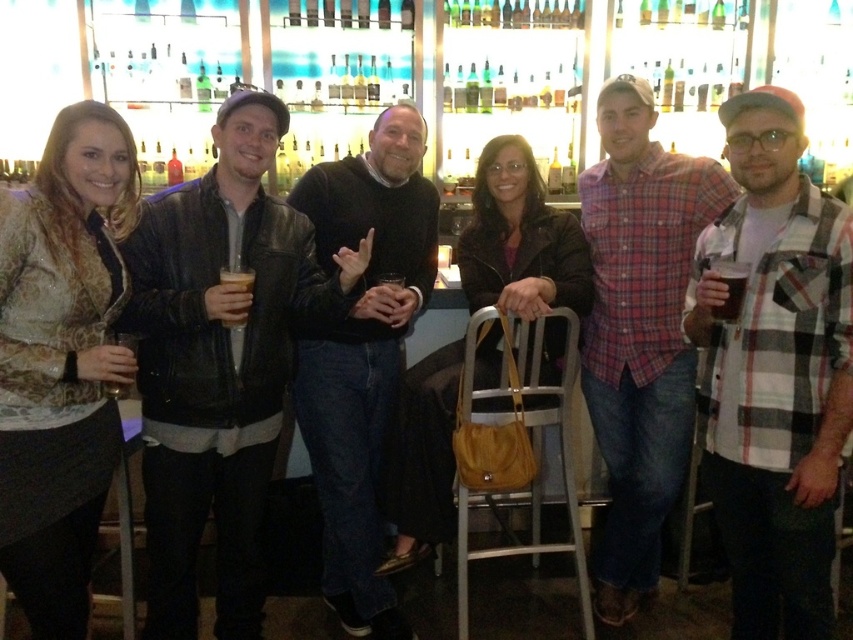
You are a bartender who needs to place a coaster between the translucent glass cup at center and the translucent glass at left. The coaster has a diameter of 10 centimeters. Can you fit the coaster between them without moving either glass?

The distance between the translucent glass cup at center and the translucent glass at left is 31.16 centimeters. Since the coaster is only 10 centimeters in diameter, there is enough space to place it between them without moving either glass.

You are a bartender preparing to serve a drink to the group. You need to place the drink exactly between the plaid flannel shirt at center and the translucent glass cup at center. How far apart should you position them?

The distance between the plaid flannel shirt at center and the translucent glass cup at center is 4.01 feet, so you should position them 4.01 feet apart.

You are a bartender who needs to deliver a drink to the customer at the center of the image. You see the plaid shirt at center and the translucent glass cup at center. Which object is closer to you?

The plaid shirt at center is closer to you because the translucent glass cup at center is behind it.